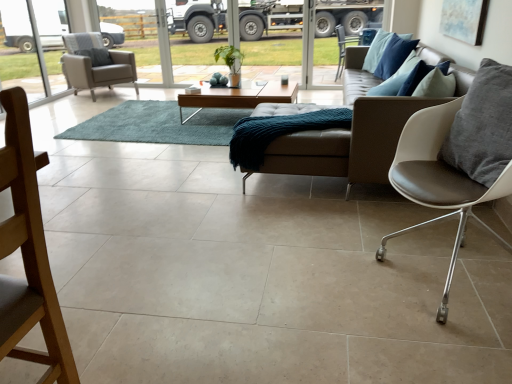
Question: From a real-world perspective, is white leather chair at right, acting as the third chair starting from the left, located beneath gray leather pillow at right?

Choices:
 (A) yes
 (B) no

Answer: (A)

Question: Does white leather chair at right, acting as the third chair starting from the left, have a lesser width compared to gray leather pillow at right?

Choices:
 (A) yes
 (B) no

Answer: (B)

Question: Is gray leather pillow at right at the back of white leather chair at right, the 2th chair from the bottom?

Choices:
 (A) no
 (B) yes

Answer: (B)

Question: Does white leather chair at right, the 1th chair viewed from the right, lie in front of gray leather pillow at right?

Choices:
 (A) yes
 (B) no

Answer: (B)

Question: Is white leather chair at right, acting as the third chair starting from the left, bigger than gray leather pillow at right?

Choices:
 (A) no
 (B) yes

Answer: (B)

Question: Relative to light gray fabric chair at left, is wooden chair at lower left, which is the third chair in top-to-bottom order, in front or behind?

Choices:
 (A) behind
 (B) front

Answer: (B)

Question: Choose the correct answer: Is wooden chair at lower left, which ranks as the third chair in back-to-front order, inside light gray fabric chair at left or outside it?

Choices:
 (A) inside
 (B) outside

Answer: (B)

Question: From the image's perspective, is wooden chair at lower left, the first chair from the front, located above or below light gray fabric chair at left?

Choices:
 (A) below
 (B) above

Answer: (A)

Question: From their relative heights in the image, would you say wooden chair at lower left, which is the 1th chair from bottom to top, is taller or shorter than light gray fabric chair at left?

Choices:
 (A) tall
 (B) short

Answer: (B)

Question: Is teal shaggy rug at center taller or shorter than light gray fabric armchair at left, the third chair viewed from the front?

Choices:
 (A) tall
 (B) short

Answer: (B)

Question: Considering their positions, is teal shaggy rug at center located in front of or behind light gray fabric armchair at left, placed as the 3th chair when sorted from bottom to top?

Choices:
 (A) front
 (B) behind

Answer: (A)

Question: Considering the relative positions of teal shaggy rug at center and light gray fabric armchair at left, placed as the 3th chair when sorted from bottom to top, in the image provided, is teal shaggy rug at center to the left or to the right of light gray fabric armchair at left, placed as the 3th chair when sorted from bottom to top,?

Choices:
 (A) right
 (B) left

Answer: (A)

Question: Based on their sizes in the image, would you say teal shaggy rug at center is bigger or smaller than light gray fabric armchair at left, the first chair from the back?

Choices:
 (A) small
 (B) big

Answer: (A)

Question: Considering the positions of point (207, 142) and point (272, 94), is point (207, 142) closer or farther from the camera than point (272, 94)?

Choices:
 (A) closer
 (B) farther

Answer: (A)

Question: From the image's perspective, is teal shaggy rug at center located above or below light brown wooden coffee table at center?

Choices:
 (A) above
 (B) below

Answer: (B)